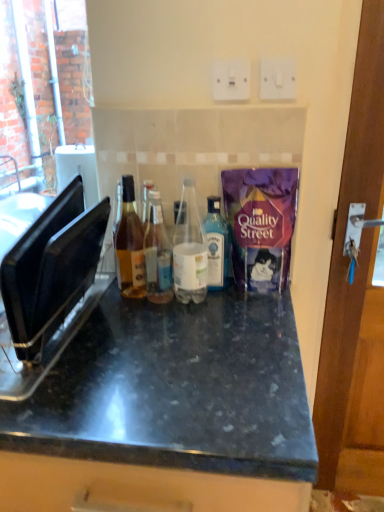
The image size is (384, 512). I want to click on vacant space to the right of blue glass bottle at center, which ranks as the 4th bottle in left-to-right order, so click(x=257, y=293).